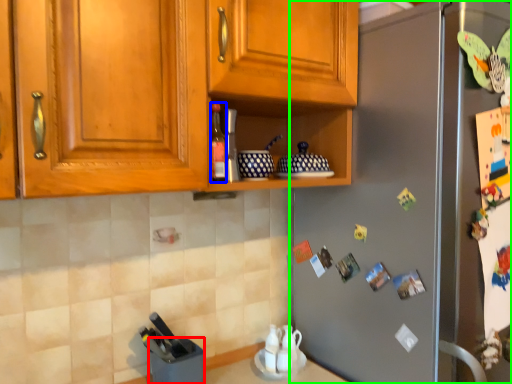
Question: Which object is the farthest from appliance (highlighted by a red box)? Choose among these: bottle (highlighted by a blue box) or refrigerator (highlighted by a green box).

Choices:
 (A) bottle
 (B) refrigerator

Answer: (B)